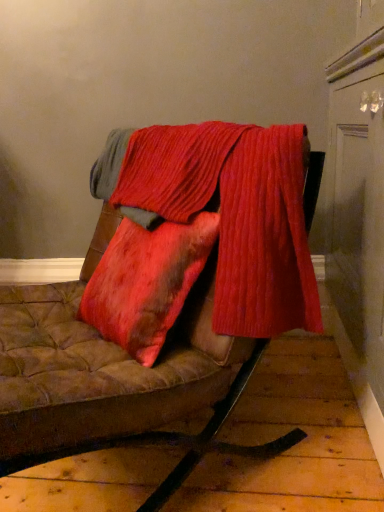
What do you see at coordinates (227, 212) in the screenshot?
I see `ribbed red fabric at center` at bounding box center [227, 212].

Locate an element on the screen. ribbed red fabric at center is located at coordinates (227, 212).

In order to click on velvet-like brown cushion at center in this screenshot , I will do `click(181, 442)`.

The image size is (384, 512). Describe the element at coordinates (181, 442) in the screenshot. I see `velvet-like brown cushion at center` at that location.

Locate an element on the screen. The image size is (384, 512). ribbed red fabric at center is located at coordinates (227, 212).

Does ribbed red fabric at center appear on the right side of velvet-like brown cushion at center?

Yes.

Is the position of ribbed red fabric at center more distant than that of velvet-like brown cushion at center?

Yes.

Does point (255, 145) lie behind point (209, 435)?

That is True.

Based on the photo, from the image's perspective, is ribbed red fabric at center located beneath velvet-like brown cushion at center?

Incorrect, from the image's perspective, ribbed red fabric at center is higher than velvet-like brown cushion at center.

From a real-world perspective, which is physically below, ribbed red fabric at center or velvet-like brown cushion at center?

velvet-like brown cushion at center, from a real-world perspective.

Considering the relative sizes of ribbed red fabric at center and velvet-like brown cushion at center in the image provided, is ribbed red fabric at center wider than velvet-like brown cushion at center?

No.

Considering the sizes of objects ribbed red fabric at center and velvet-like brown cushion at center in the image provided, who is shorter, ribbed red fabric at center or velvet-like brown cushion at center?

Standing shorter between the two is ribbed red fabric at center.

Considering the relative sizes of ribbed red fabric at center and velvet-like brown cushion at center in the image provided, is ribbed red fabric at center smaller than velvet-like brown cushion at center?

Yes, ribbed red fabric at center is smaller than velvet-like brown cushion at center.

Is ribbed red fabric at center not within velvet-like brown cushion at center?

No, most part of ribbed red fabric at center lies within velvet-like brown cushion at center.

Based on the photo, are ribbed red fabric at center and velvet-like brown cushion at center located far from each other?

No, there isn't a large distance between ribbed red fabric at center and velvet-like brown cushion at center.

Is ribbed red fabric at center facing towards velvet-like brown cushion at center?

Yes.

How many degrees apart are the facing directions of ribbed red fabric at center and velvet-like brown cushion at center?

The angular difference between ribbed red fabric at center and velvet-like brown cushion at center is 0.000929 degrees.

How distant is ribbed red fabric at center from velvet-like brown cushion at center?

A distance of 41.16 centimeters exists between ribbed red fabric at center and velvet-like brown cushion at center.

You are a GUI agent. You are given a task and a screenshot of the screen. Output one action in this format:
    pyautogui.click(x=<x>, y=<y>)
    Task: Click on the laundry behind the velvet-like brown cushion at center
    
    Given the screenshot: What is the action you would take?
    pyautogui.click(x=227, y=212)

Which object is positioned more to the right, velvet-like brown cushion at center or ribbed red fabric at center?

Positioned to the right is ribbed red fabric at center.

Is velvet-like brown cushion at center further to camera compared to ribbed red fabric at center?

No, velvet-like brown cushion at center is closer to the camera.

Considering the positions of points (172, 438) and (222, 139), is point (172, 438) closer to camera compared to point (222, 139)?

No, it is behind (222, 139).

From the image's perspective, is velvet-like brown cushion at center above ribbed red fabric at center?

Incorrect, from the image's perspective, velvet-like brown cushion at center is lower than ribbed red fabric at center.

From a real-world perspective, which is physically below, velvet-like brown cushion at center or ribbed red fabric at center?

From a 3D spatial view, velvet-like brown cushion at center is below.

Looking at their sizes, would you say velvet-like brown cushion at center is wider or thinner than ribbed red fabric at center?

velvet-like brown cushion at center is wider than ribbed red fabric at center.

Does velvet-like brown cushion at center have a greater height compared to ribbed red fabric at center?

Correct, velvet-like brown cushion at center is much taller as ribbed red fabric at center.

Considering the relative sizes of velvet-like brown cushion at center and ribbed red fabric at center in the image provided, is velvet-like brown cushion at center smaller than ribbed red fabric at center?

No.

Is ribbed red fabric at center inside velvet-like brown cushion at center?

That's correct, ribbed red fabric at center is inside velvet-like brown cushion at center.

Is velvet-like brown cushion at center next to ribbed red fabric at center and touching it?

No, velvet-like brown cushion at center is not next to ribbed red fabric at center.

Could you tell me if velvet-like brown cushion at center is facing ribbed red fabric at center?

No.

Can you tell me how much velvet-like brown cushion at center and ribbed red fabric at center differ in facing direction?

They differ by 0.000929 degrees in their facing directions.

From the picture: Measure the distance from velvet-like brown cushion at center to ribbed red fabric at center.

velvet-like brown cushion at center and ribbed red fabric at center are 16.21 inches apart from each other.

Where is `furniture below the ribbed red fabric at center (from the image's perspective)`? furniture below the ribbed red fabric at center (from the image's perspective) is located at coordinates (181, 442).

The width and height of the screenshot is (384, 512). In order to click on laundry behind the velvet-like brown cushion at center in this screenshot , I will do `click(227, 212)`.

Find the location of `furniture on the left of ribbed red fabric at center`. furniture on the left of ribbed red fabric at center is located at coordinates (181, 442).